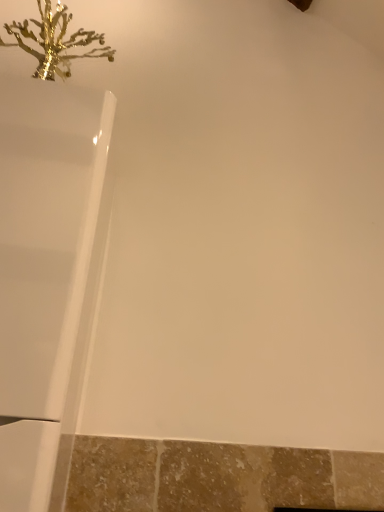
Question: In terms of height, does white glossy bathtub at upper left look taller or shorter compared to gold metallic coral at upper left?

Choices:
 (A) tall
 (B) short

Answer: (A)

Question: Looking at their shapes, would you say white glossy bathtub at upper left is wider or thinner than gold metallic coral at upper left?

Choices:
 (A) wide
 (B) thin

Answer: (A)

Question: Is point coord(82,229) positioned closer to the camera than point coord(69,12)?

Choices:
 (A) farther
 (B) closer

Answer: (B)

Question: Does point (29, 31) appear closer or farther from the camera than point (69, 445)?

Choices:
 (A) farther
 (B) closer

Answer: (A)

Question: Based on their positions, is gold metallic coral at upper left located to the left or right of white glossy bathtub at upper left?

Choices:
 (A) left
 (B) right

Answer: (A)

Question: Considering their positions, is gold metallic coral at upper left located in front of or behind white glossy bathtub at upper left?

Choices:
 (A) front
 (B) behind

Answer: (B)

Question: Considering the positions of gold metallic coral at upper left and white glossy bathtub at upper left in the image, is gold metallic coral at upper left wider or thinner than white glossy bathtub at upper left?

Choices:
 (A) wide
 (B) thin

Answer: (B)